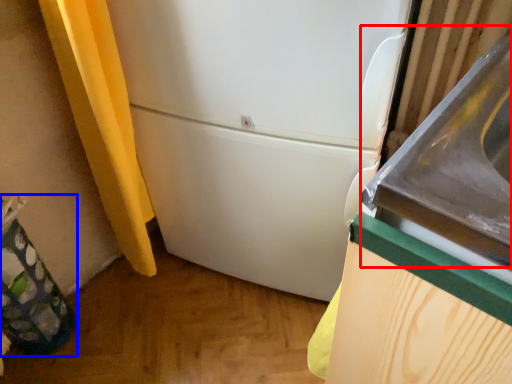
Question: Among these objects, which one is farthest to the camera, sink (highlighted by a red box) or garbage (highlighted by a blue box)?

Choices:
 (A) sink
 (B) garbage

Answer: (B)